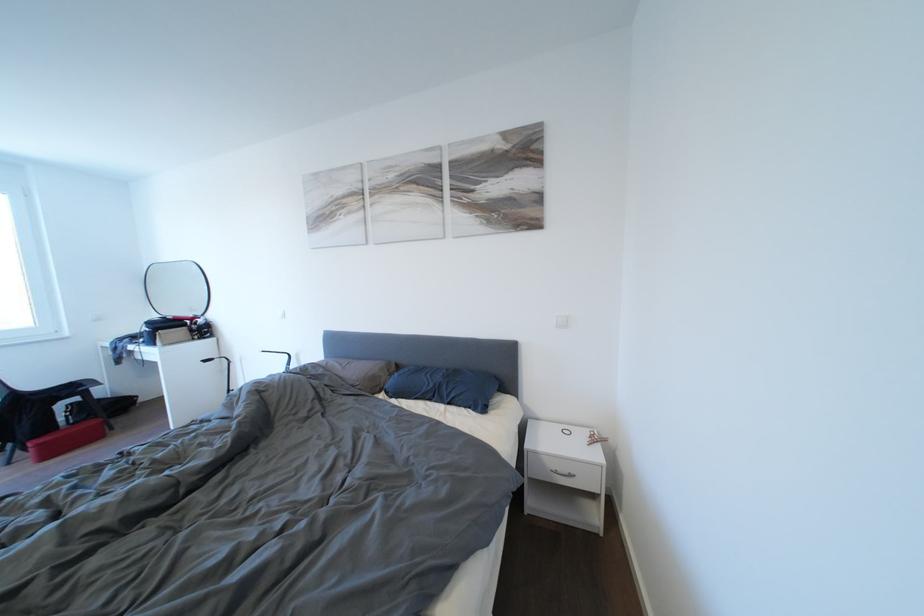
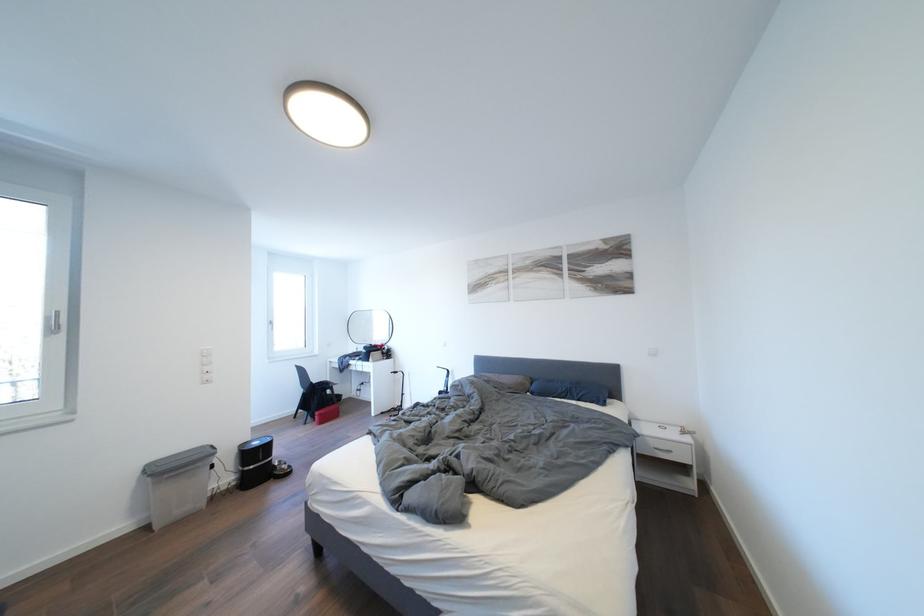
Find the pixel in the second image that matches point 558,469 in the first image.

(661, 448)